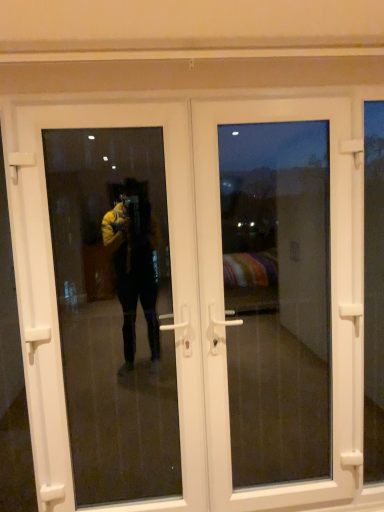
Question: Is white plastic door at center, positioned as the first door in left-to-right order, inside or outside of white plastic door at center, which ranks as the second door in left-to-right order?

Choices:
 (A) inside
 (B) outside

Answer: (A)

Question: From the image's perspective, is white plastic door at center, positioned as the 2th door in right-to-left order, positioned above or below white plastic door at center, which ranks as the second door in left-to-right order?

Choices:
 (A) above
 (B) below

Answer: (B)

Question: Which of these objects is positioned closest to the transparent glass door at left?

Choices:
 (A) white plastic door at center, positioned as the first door in left-to-right order
 (B) white plastic door at center, which ranks as the second door in left-to-right order

Answer: (A)

Question: Based on their relative distances, which object is nearer to the transparent glass door at left?

Choices:
 (A) white plastic door at center, positioned as the first door in left-to-right order
 (B) white plastic door at center, which ranks as the 1th door in right-to-left order

Answer: (A)